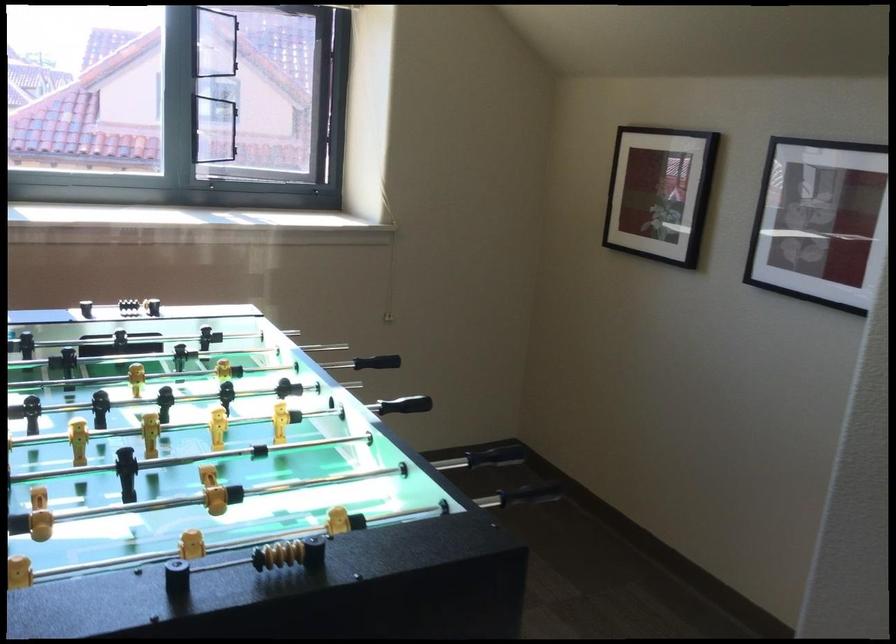
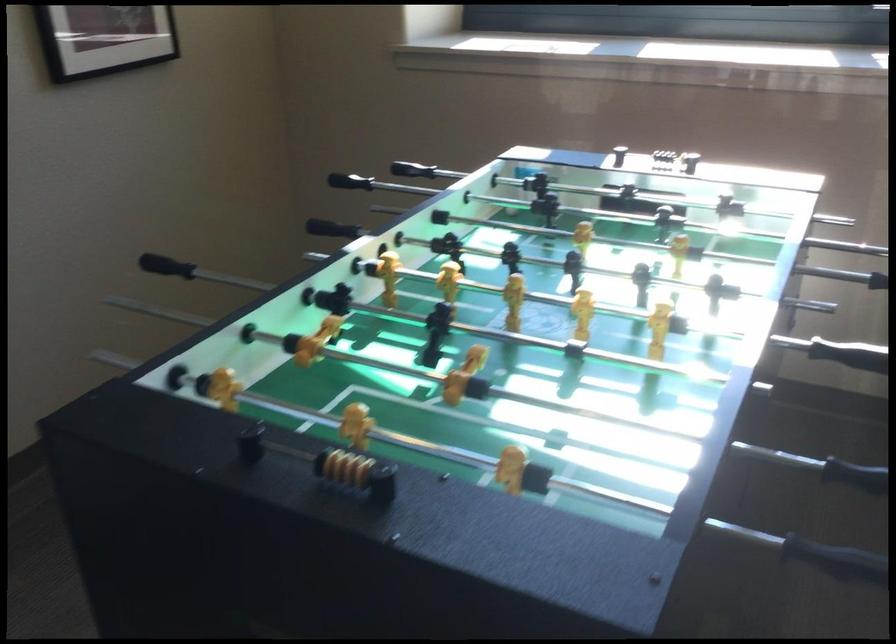
Question: The camera is either moving clockwise (left) or counter-clockwise (right) around the object. The first image is from the beginning of the video and the second image is from the end. Is the camera moving left or right when shooting the video?

Choices:
 (A) Left
 (B) Right

Answer: (B)